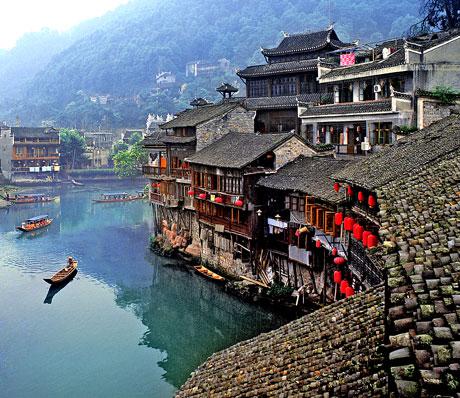
This screenshot has height=398, width=460. Identify the location of hung up clothes. (345, 63).